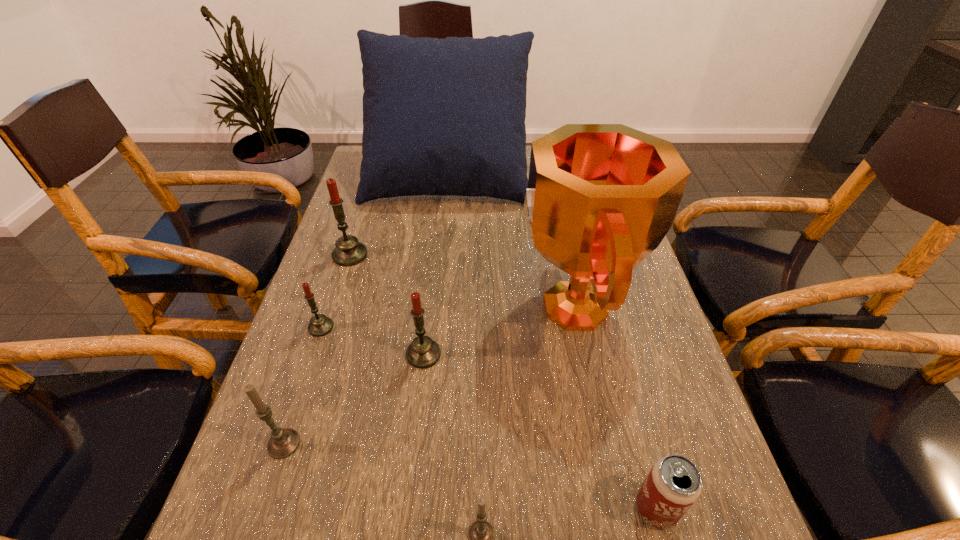
Where is `vacant point located between the biggest red candle and the second farthest red candle`? The height and width of the screenshot is (540, 960). vacant point located between the biggest red candle and the second farthest red candle is located at coordinates (335, 291).

Identify the location of free area in between the bigger gray candle and the second biggest red candle. This screenshot has height=540, width=960. (353, 399).

The width and height of the screenshot is (960, 540). What are the coordinates of `vacant area between the award and the farthest object` in the screenshot? It's located at (511, 241).

Identify the location of empty space between the fourth nearest candle and the red beer can. This screenshot has width=960, height=540. (489, 418).

In order to click on free space between the farther gray candle and the fourth candle from left to right in this screenshot , I will do `click(353, 399)`.

Where is `free area in between the cushion and the red beer can`? This screenshot has width=960, height=540. free area in between the cushion and the red beer can is located at coordinates (552, 342).

In order to click on free point between the farthest red candle and the cushion in this screenshot , I will do `click(398, 215)`.

Locate which object is the sixth closest to the red beer can. Please provide its 2D coordinates. Your answer should be formatted as a tuple, i.e. [(x, y)], where the tuple contains the x and y coordinates of a point satisfying the conditions above.

[(348, 252)]

Where is `object that can be found as the fourth closest to the left gray candle`? object that can be found as the fourth closest to the left gray candle is located at coordinates (601, 197).

You are a GUI agent. You are given a task and a screenshot of the screen. Output one action in this format:
    pyautogui.click(x=<x>, y=<y>)
    Task: Click on the candle that can be found as the second closest to the farthest candle
    The width and height of the screenshot is (960, 540).
    Given the screenshot: What is the action you would take?
    pyautogui.click(x=423, y=352)